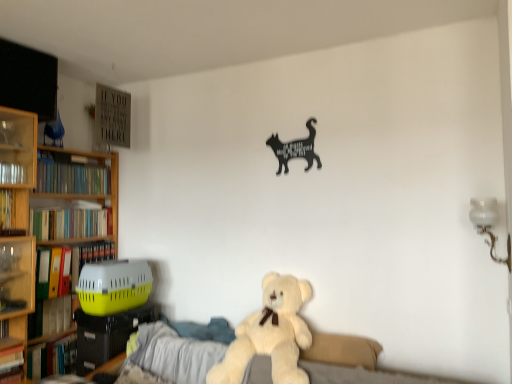
Measure the distance between hardcover books at left, the fifth book positioned from the bottom, and camera.

A distance of 2.79 meters exists between hardcover books at left, the fifth book positioned from the bottom, and camera.

At what (x,y) coordinates should I click in order to perform the action: click on black matte cat at upper center. Please return your answer as a coordinate pair (x, y). This screenshot has width=512, height=384. Looking at the image, I should click on (295, 149).

Identify the location of yellow plastic pet carrier at left, the third book in the bottom-to-top sequence. This screenshot has height=384, width=512. (89, 258).

Where is `wooden bookcase at left`? This screenshot has width=512, height=384. wooden bookcase at left is located at coordinates (36, 176).

Is yellow matte folder at left, positioned as the 4th book in top-to-bottom order, situated inside wooden bookcase at left or outside?

yellow matte folder at left, positioned as the 4th book in top-to-bottom order, fits inside wooden bookcase at left.

Identify the location of the 1st book in front of the wooden bookcase at left, counting from the anchor's position. (54, 273).

Is point (45, 271) closer or farther from the camera than point (117, 235)?

Point (45, 271) is closer to the camera than point (117, 235).

Is yellow matte folder at left, the 4th book in the bottom-to-top sequence, beside wooden bookcase at left?

No, yellow matte folder at left, the 4th book in the bottom-to-top sequence, is not in contact with wooden bookcase at left.

Is fluffy white teddy bear at center positioned beyond the bounds of wooden bookcase at left?

Indeed, fluffy white teddy bear at center is completely outside wooden bookcase at left.

Is wooden bookcase at left at the back of fluffy white teddy bear at center?

That's not correct — fluffy white teddy bear at center is not looking away from wooden bookcase at left.

Considering the points (247, 360) and (21, 204), which point is behind, point (247, 360) or point (21, 204)?

Positioned behind is point (21, 204).

Find the location of a particular element. The height and width of the screenshot is (384, 512). teddy bear below the wooden bookcase at left (from the image's perspective) is located at coordinates (270, 334).

Which point is more distant from viewer, (50,318) or (293,363)?

Point (50,318)

Looking at this image, is hardcover book at left, the sixth book viewed from the top, oriented away from fluffy white teddy bear at center?

No, fluffy white teddy bear at center is not at the back of hardcover book at left, the sixth book viewed from the top.

Is hardcover book at left, the 2th book positioned from the bottom, taller or shorter than fluffy white teddy bear at center?

Clearly, hardcover book at left, the 2th book positioned from the bottom, is shorter compared to fluffy white teddy bear at center.

From the image's perspective, relative to fluffy white teddy bear at center, is hardcover book at left, the sixth book viewed from the top, above or below?

Clearly, from the image's perspective, hardcover book at left, the sixth book viewed from the top, is below fluffy white teddy bear at center.

Does point (59, 362) lie in front of point (271, 340)?

No.

Does hardcover book at left, the 7th book when ordered from top to bottom, turn towards fluffy white teddy bear at center?

Yes, hardcover book at left, the 7th book when ordered from top to bottom, is turned towards fluffy white teddy bear at center.

Locate an element on the screen. The height and width of the screenshot is (384, 512). the 5th book to the left of the fluffy white teddy bear at center, starting your count from the anchor is located at coordinates (52, 357).

Is fluffy white teddy bear at center touching hardcover book at left, positioned as the 1th book in bottom-to-top order?

No, fluffy white teddy bear at center is not beside hardcover book at left, positioned as the 1th book in bottom-to-top order.

Can you confirm if fluffy white teddy bear at center is positioned to the left of hardcover book at left, the 7th book when ordered from top to bottom?

No.

Is fluffy white teddy bear at center facing towards hardcover book at left, the 7th book when ordered from top to bottom?

No.

Based on the photo, does green matte bookshelf at left, which is counted as the seventh book, starting from the bottom, come behind yellow plastic pet carrier at left, which is the 5th book from top to bottom?

No, green matte bookshelf at left, which is counted as the seventh book, starting from the bottom, is in front of yellow plastic pet carrier at left, which is the 5th book from top to bottom.

Consider the image. Does green matte bookshelf at left, which ranks as the first book in top-to-bottom order, have a greater width compared to yellow plastic pet carrier at left, which is the 5th book from top to bottom?

Answer: Indeed, green matte bookshelf at left, which ranks as the first book in top-to-bottom order, has a greater width compared to yellow plastic pet carrier at left, which is the 5th book from top to bottom.

Is yellow plastic pet carrier at left, the third book in the bottom-to-top sequence, a part of green matte bookshelf at left, which is counted as the seventh book, starting from the bottom?

Actually, yellow plastic pet carrier at left, the third book in the bottom-to-top sequence, is outside green matte bookshelf at left, which is counted as the seventh book, starting from the bottom.

From a real-world perspective, relative to wooden bookcase at left, is hardcover book at left, placed as the 6th book when sorted from bottom to top, vertically above or below?

In terms of real-world spatial position, hardcover book at left, placed as the 6th book when sorted from bottom to top, is above wooden bookcase at left.

Is hardcover book at left, arranged as the 2th book when viewed from the top, further to the viewer compared to wooden bookcase at left?

That is False.

Can you confirm if hardcover book at left, placed as the 6th book when sorted from bottom to top, is thinner than wooden bookcase at left?

Indeed, hardcover book at left, placed as the 6th book when sorted from bottom to top, has a lesser width compared to wooden bookcase at left.

At what (x,y) coordinates should I click in order to perform the action: click on bookcase above the yellow matte folder at left, the 4th book in the bottom-to-top sequence (from the image's perspective). Please return your answer as a coordinate pair (x, y). Looking at the image, I should click on (36, 176).

You are a GUI agent. You are given a task and a screenshot of the screen. Output one action in this format:
    pyautogui.click(x=<x>, y=<y>)
    Task: Click on the teddy bear on the right of wooden bookcase at left
    
    Given the screenshot: What is the action you would take?
    pyautogui.click(x=270, y=334)

Looking at the image, which one is located closer to hardcover books at left, the fifth book positioned from the bottom, yellow matte folder at left, positioned as the 4th book in top-to-bottom order, or wooden bookcase at left?

The object closer to hardcover books at left, the fifth book positioned from the bottom, is wooden bookcase at left.

Based on their spatial positions, is hardcover book at left, arranged as the 2th book when viewed from the top, or green matte bookshelf at left, which ranks as the first book in top-to-bottom order, closer to fluffy white teddy bear at center?

hardcover book at left, arranged as the 2th book when viewed from the top, is closer to fluffy white teddy bear at center.

Based on their spatial positions, is yellow plastic pet carrier at left, which is the 5th book from top to bottom, or green matte bookshelf at left, which is counted as the seventh book, starting from the bottom, closer to hardcover book at left, placed as the 6th book when sorted from bottom to top?

green matte bookshelf at left, which is counted as the seventh book, starting from the bottom.

Which object lies further to the anchor point yellow matte folder at left, the 4th book in the bottom-to-top sequence, fluffy white teddy bear at center or yellow plastic pet carrier at left, which is the 5th book from top to bottom?

fluffy white teddy bear at center lies further to yellow matte folder at left, the 4th book in the bottom-to-top sequence, than the other object.

When comparing their distances from black matte cat at upper center, does hardcover books at left, placed as the 3th book when sorted from top to bottom, or hardcover book at left, the 2th book positioned from the bottom, seem closer?

hardcover books at left, placed as the 3th book when sorted from top to bottom, is positioned closer to the anchor black matte cat at upper center.

From the image, which object appears to be nearer to wooden bookcase at left, hardcover book at left, the 7th book when ordered from top to bottom, or hardcover books at left, placed as the 3th book when sorted from top to bottom?

hardcover books at left, placed as the 3th book when sorted from top to bottom, is positioned closer to the anchor wooden bookcase at left.

Considering their positions, is black matte cat at upper center positioned closer to fluffy white teddy bear at center than hardcover book at left, positioned as the 1th book in bottom-to-top order?

The object closer to fluffy white teddy bear at center is black matte cat at upper center.

Which object lies further to the anchor point yellow matte folder at left, the 4th book in the bottom-to-top sequence, yellow plastic pet carrier at left, which is the 5th book from top to bottom, or hardcover books at left, the fifth book positioned from the bottom?

Among the two, hardcover books at left, the fifth book positioned from the bottom, is located further to yellow matte folder at left, the 4th book in the bottom-to-top sequence.

What are the coordinates of `bookcase between hardcover book at left, positioned as the 1th book in bottom-to-top order, and fluffy white teddy bear at center` in the screenshot? It's located at (36, 176).

Find the location of a particular element. teddy bear between yellow matte folder at left, the 4th book in the bottom-to-top sequence, and black matte cat at upper center is located at coordinates (270, 334).

Locate an element on the screen. This screenshot has height=384, width=512. book between yellow matte folder at left, the 4th book in the bottom-to-top sequence, and hardcover book at left, the 2th book positioned from the bottom, from top to bottom is located at coordinates (89, 258).

Locate an element on the screen. bookcase that lies between green matte bookshelf at left, which is counted as the seventh book, starting from the bottom, and yellow matte folder at left, the 4th book in the bottom-to-top sequence, from top to bottom is located at coordinates (36, 176).